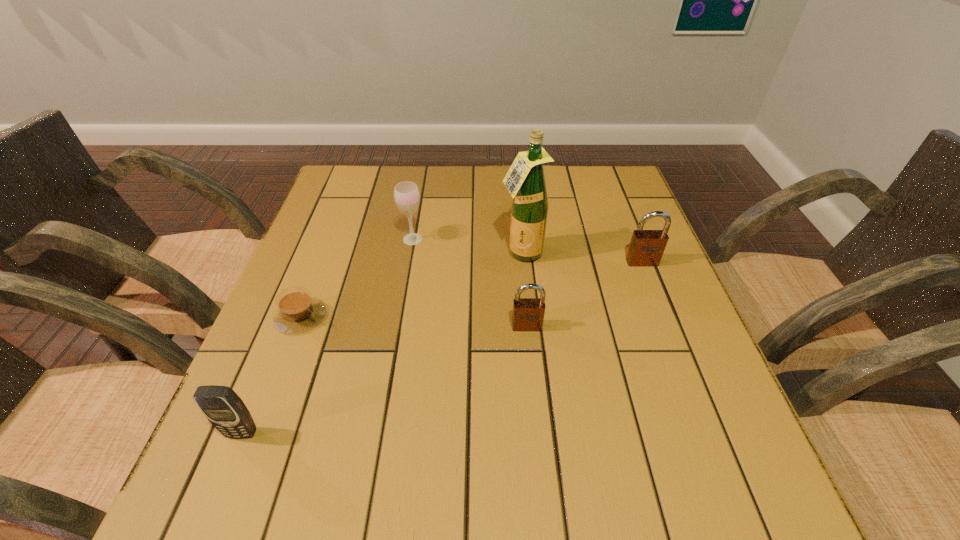
You are a GUI agent. You are given a task and a screenshot of the screen. Output one action in this format:
    pyautogui.click(x=<x>, y=<y>)
    Task: Click on the vacant space located on the right of the wineglass
    The height and width of the screenshot is (540, 960).
    Given the screenshot: What is the action you would take?
    pyautogui.click(x=468, y=239)

Where is `vacant space located on the front-facing side of the liquor`? The image size is (960, 540). vacant space located on the front-facing side of the liquor is located at coordinates (537, 400).

Identify the location of vacant space situated on the back of the shortest object. (327, 246).

Identify the location of object located at the near edge. (225, 410).

Where is `cappuccino at the left edge`? cappuccino at the left edge is located at coordinates (298, 311).

What are the coordinates of `cellular telephone that is at the left edge` in the screenshot? It's located at (225, 410).

This screenshot has width=960, height=540. In order to click on object present at the right edge in this screenshot , I will do `click(646, 248)`.

You are a GUI agent. You are given a task and a screenshot of the screen. Output one action in this format:
    pyautogui.click(x=<x>, y=<y>)
    Task: Click on the object that is positioned at the near left corner
    The height and width of the screenshot is (540, 960).
    Given the screenshot: What is the action you would take?
    pyautogui.click(x=225, y=410)

Identify the location of vacant region at the far edge of the desktop. Image resolution: width=960 pixels, height=540 pixels. 420,173.

Identify the location of vacant space at the near edge. (442, 404).